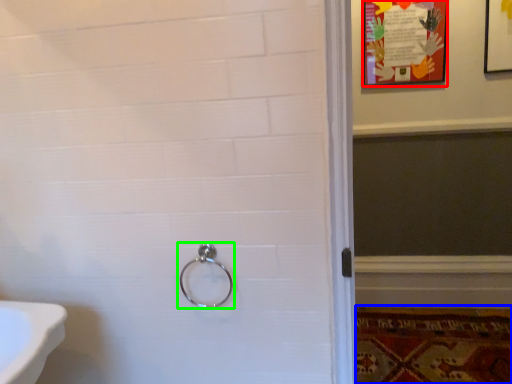
Question: Which object is the farthest from poster page (highlighted by a red box)? Choose among these: mat (highlighted by a blue box) or door handle (highlighted by a green box).

Choices:
 (A) mat
 (B) door handle

Answer: (B)